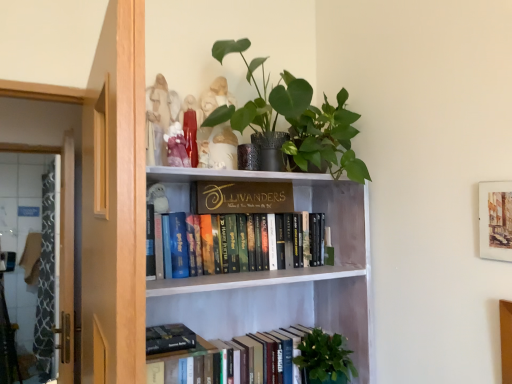
Question: Relative to hardcover books at center, arranged as the second book when ordered from the bottom, is green matte plant at lower center in front or behind?

Choices:
 (A) front
 (B) behind

Answer: (B)

Question: Is green matte plant at lower center bigger or smaller than hardcover books at center, arranged as the second book when ordered from the bottom?

Choices:
 (A) big
 (B) small

Answer: (B)

Question: Which of these objects is positioned closest to the wooden screen door at left?

Choices:
 (A) hardcover books at center, the first book from the top
 (B) watercolor paper picture frame at upper right
 (C) hardcover book at lower center, placed as the first book when sorted from bottom to top
 (D) green matte plant at upper center
 (E) green matte plant at lower center

Answer: (C)

Question: Which is nearer to the watercolor paper picture frame at upper right?

Choices:
 (A) green matte plant at lower center
 (B) white wood bookshelf at upper center
 (C) green matte plant at upper center
 (D) gold metallic sign at upper center
 (E) wooden screen door at left

Answer: (C)